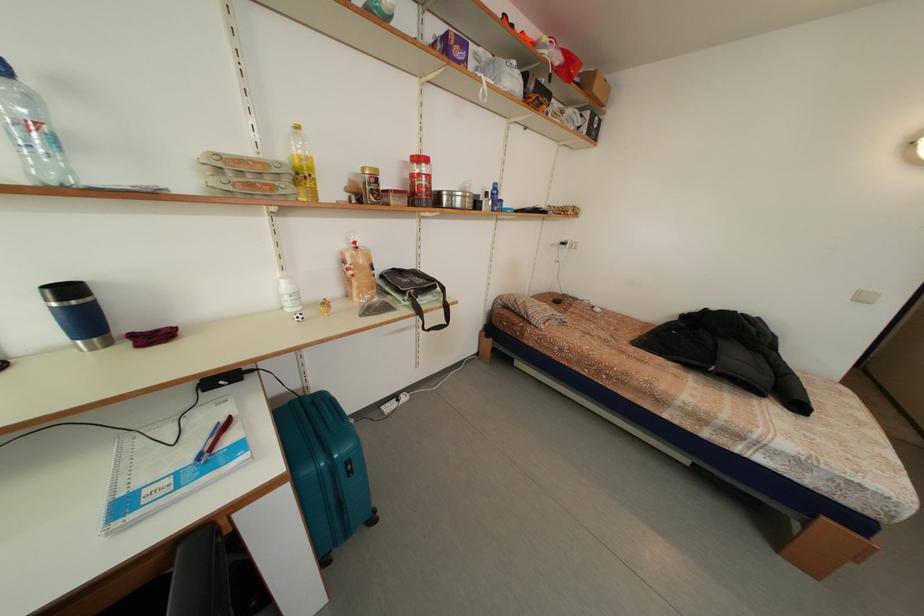
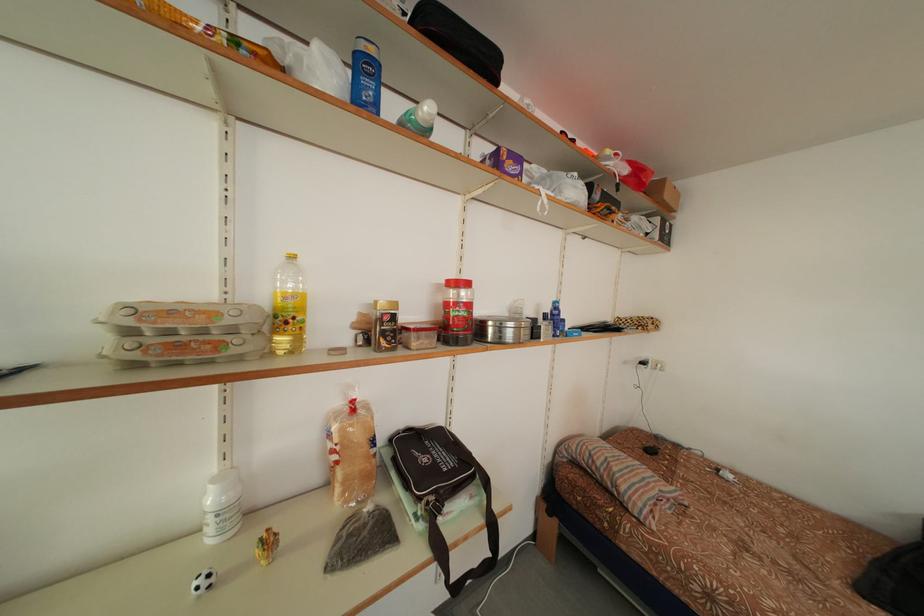
Where in the second image is the point corresponding to point 603,95 from the first image?

(675, 201)